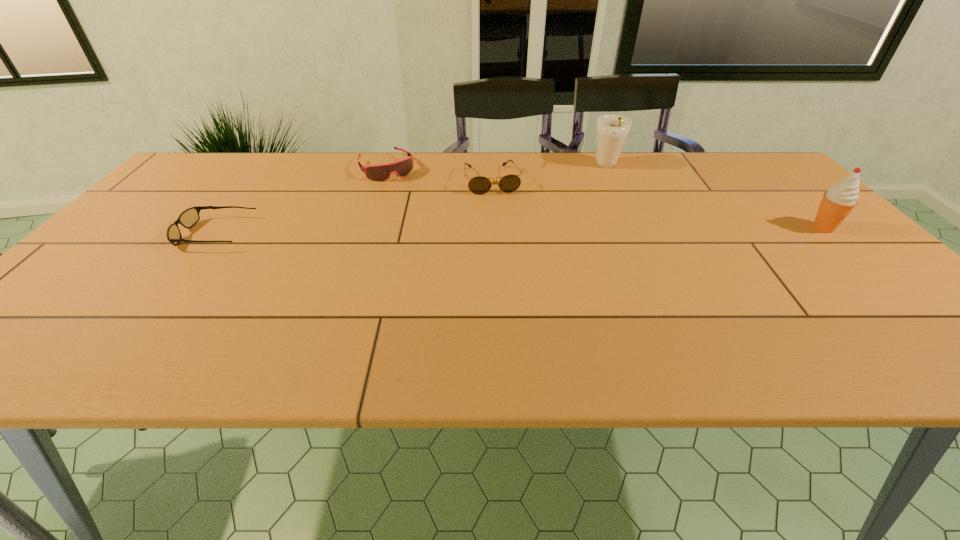
Identify the location of vacant space located on the lenses of the taller sunglasses. (525, 292).

Where is `vacant region located 0.340m on the lenses of the taller sunglasses`? vacant region located 0.340m on the lenses of the taller sunglasses is located at coordinates (519, 273).

Image resolution: width=960 pixels, height=540 pixels. Identify the location of vacant area situated on the lenses of the taller sunglasses. (516, 262).

Find the location of a particular element. vacant space located 0.080m on the drink side of the root beer is located at coordinates (602, 189).

You are a GUI agent. You are given a task and a screenshot of the screen. Output one action in this format:
    pyautogui.click(x=<x>, y=<y>)
    Task: Click on the free region located on the drink side of the root beer
    
    Given the screenshot: What is the action you would take?
    pyautogui.click(x=584, y=241)

This screenshot has height=540, width=960. Find the location of `free region located on the drink side of the root beer`. free region located on the drink side of the root beer is located at coordinates (587, 233).

The image size is (960, 540). Identify the location of free spot located on the front-facing side of the fourth object from right to left. tap(442, 247).

The image size is (960, 540). I want to click on vacant point located 0.350m on the front-facing side of the fourth object from right to left, so click(440, 245).

Locate an element on the screen. The height and width of the screenshot is (540, 960). vacant space situated on the front-facing side of the fourth object from right to left is located at coordinates (434, 236).

This screenshot has width=960, height=540. In order to click on sunglasses positioned at the far edge in this screenshot , I will do `click(479, 185)`.